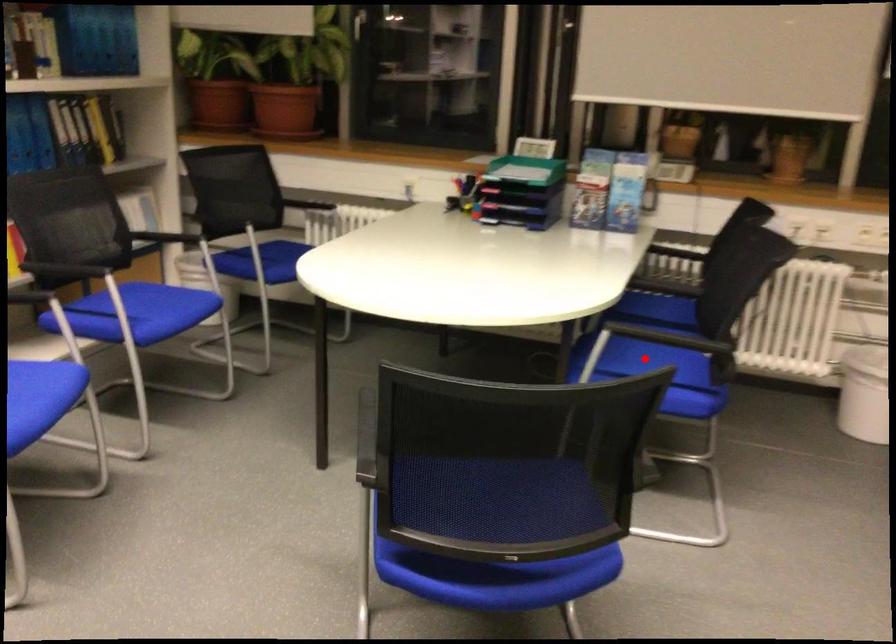
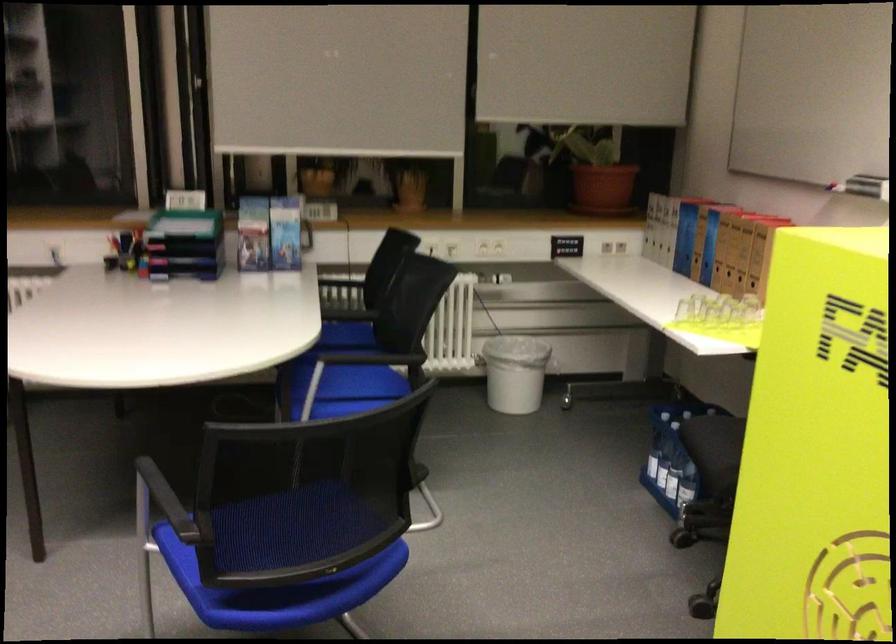
Question: I am providing you with two images of the same scene from different viewpoints. Given a red point in image1, look at the same physical point in image2. Is it:

Choices:
 (A) Closer to the viewpoint
 (B) Farther from the viewpoint

Answer: (B)